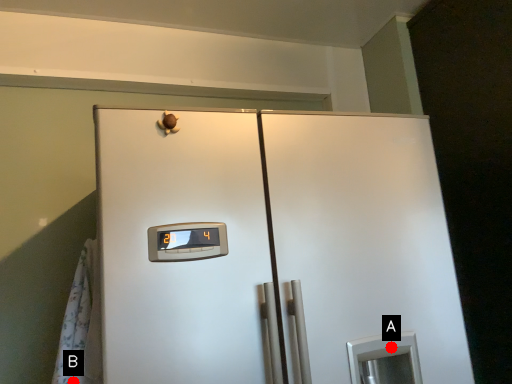
Question: Two points are circled on the image, labeled by A and B beside each circle. Among these points, which one is farthest from the camera?

Choices:
 (A) A is further
 (B) B is further

Answer: (A)